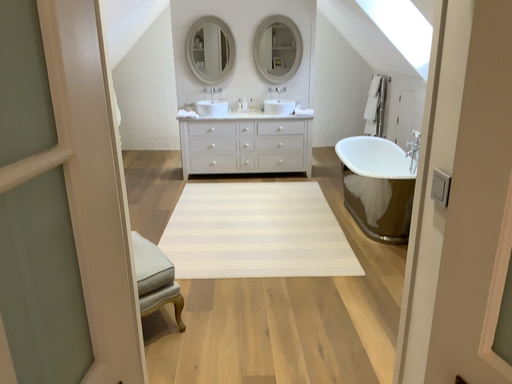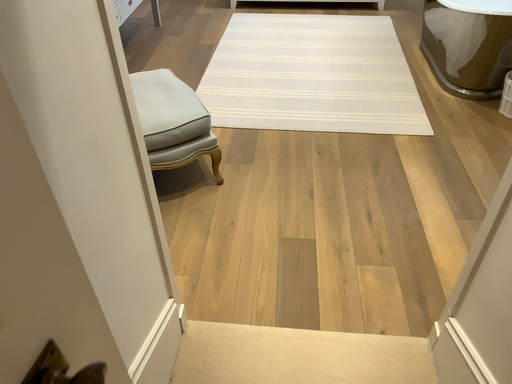
Question: Which way did the camera rotate in the video?

Choices:
 (A) rotated left
 (B) rotated right

Answer: (A)